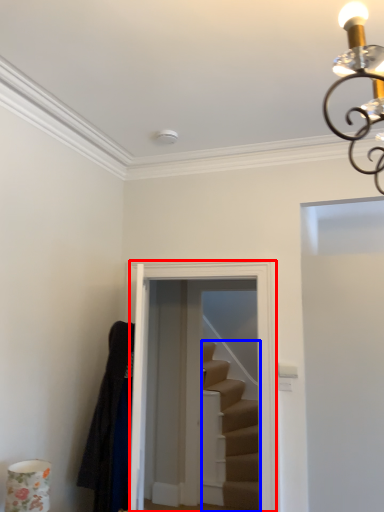
Question: Which point is further to the camera, glass door (highlighted by a red box) or stairs (highlighted by a blue box)?

Choices:
 (A) glass door
 (B) stairs

Answer: (B)